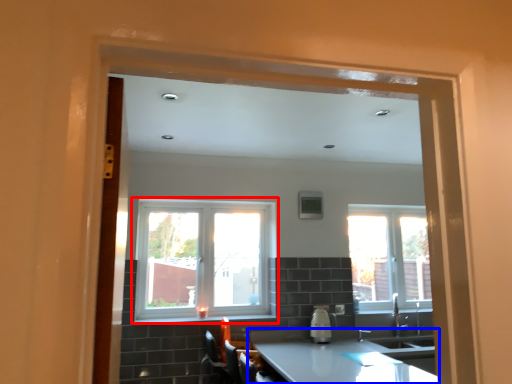
Question: Which point is closer to the camera, window (highlighted by a red box) or countertop (highlighted by a blue box)?

Choices:
 (A) window
 (B) countertop

Answer: (B)